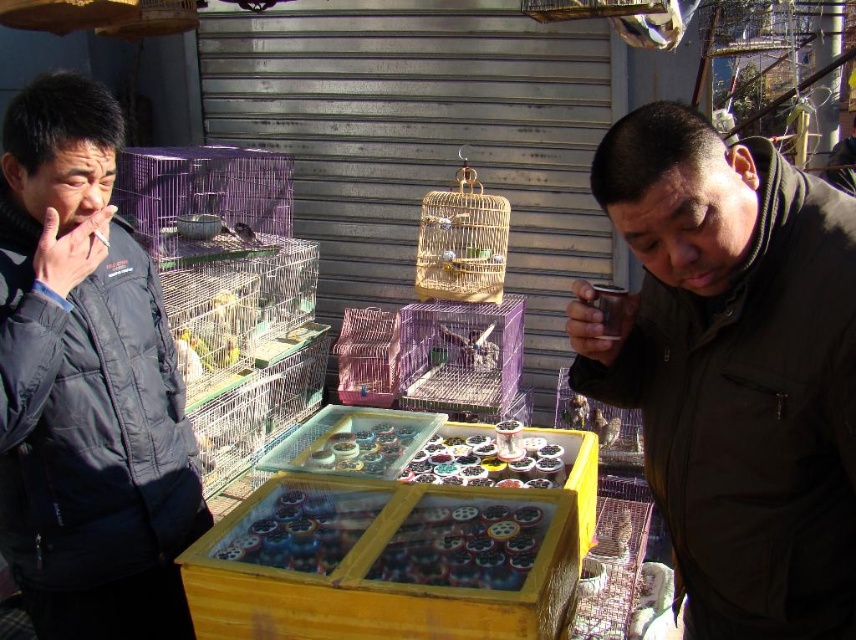
Question: Which object is positioned closest to the dark gray puffy jacket at left?

Choices:
 (A) matte brown birdcage at center
 (B) dark brown jacket at center

Answer: (B)

Question: Is dark gray puffy jacket at left wider than matte brown birdcage at center?

Choices:
 (A) yes
 (B) no

Answer: (A)

Question: Is dark brown jacket at center below matte brown birdcage at center?

Choices:
 (A) no
 (B) yes

Answer: (B)

Question: Does dark brown jacket at center lie behind dark gray puffy jacket at left?

Choices:
 (A) no
 (B) yes

Answer: (A)

Question: Among these points, which one is nearest to the camera?

Choices:
 (A) (236, 232)
 (B) (816, 634)
 (C) (0, 205)

Answer: (B)

Question: Among these objects, which one is nearest to the camera?

Choices:
 (A) matte brown birdcage at center
 (B) dark gray puffy jacket at left

Answer: (B)